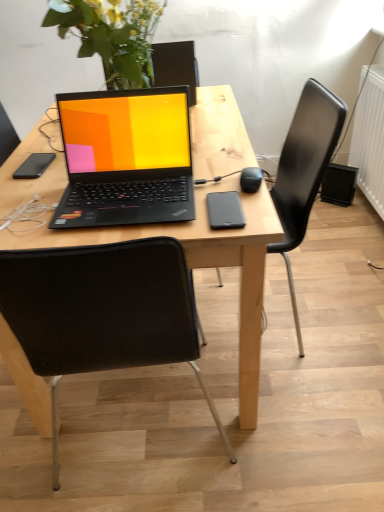
Question: Is wooden desk at center inside black matte phone at left, which ranks as the 1th mobile phone in left-to-right order?

Choices:
 (A) yes
 (B) no

Answer: (B)

Question: Is black matte phone at left, which ranks as the 1th mobile phone in left-to-right order, shorter than wooden desk at center?

Choices:
 (A) no
 (B) yes

Answer: (B)

Question: Is black matte phone at left, positioned as the first mobile phone in top-to-bottom order, located outside wooden desk at center?

Choices:
 (A) no
 (B) yes

Answer: (A)

Question: From a real-world perspective, is black matte phone at left, arranged as the second mobile phone when viewed from the right, positioned over wooden desk at center based on gravity?

Choices:
 (A) yes
 (B) no

Answer: (A)

Question: Is black matte phone at left, acting as the second mobile phone starting from the front, positioned before wooden desk at center?

Choices:
 (A) no
 (B) yes

Answer: (A)

Question: Considering the relative sizes of black matte phone at left, positioned as the first mobile phone in top-to-bottom order, and wooden desk at center in the image provided, is black matte phone at left, positioned as the first mobile phone in top-to-bottom order, bigger than wooden desk at center?

Choices:
 (A) no
 (B) yes

Answer: (A)

Question: Is black matte phone at left, positioned as the first mobile phone in top-to-bottom order, thinner than black matte phone at center, marked as the 1th mobile phone in a bottom-to-top arrangement?

Choices:
 (A) no
 (B) yes

Answer: (B)

Question: Is black matte phone at left, which appears as the second mobile phone when ordered from the bottom, outside black matte phone at center, which appears as the 1th mobile phone when viewed from the front?

Choices:
 (A) no
 (B) yes

Answer: (B)

Question: From a real-world perspective, is black matte phone at left, arranged as the second mobile phone when viewed from the right, located higher than black matte phone at center, marked as the 1th mobile phone in a bottom-to-top arrangement?

Choices:
 (A) no
 (B) yes

Answer: (A)

Question: Does black matte phone at left, which ranks as the 1th mobile phone in left-to-right order, have a smaller size compared to black matte phone at center, which appears as the 1th mobile phone when viewed from the front?

Choices:
 (A) yes
 (B) no

Answer: (A)

Question: Can you confirm if black matte phone at left, acting as the second mobile phone starting from the front, is wider than black matte phone at center, which appears as the 1th mobile phone when viewed from the front?

Choices:
 (A) no
 (B) yes

Answer: (A)

Question: Would you consider black matte phone at left, which appears as the second mobile phone when ordered from the bottom, to be distant from black matte phone at center, marked as the 1th mobile phone in a bottom-to-top arrangement?

Choices:
 (A) no
 (B) yes

Answer: (B)

Question: Considering the relative positions of wooden desk at center and black fabric chair at center, placed as the second chair when sorted from right to left, in the image provided, is wooden desk at center to the right of black fabric chair at center, placed as the second chair when sorted from right to left, from the viewer's perspective?

Choices:
 (A) no
 (B) yes

Answer: (B)